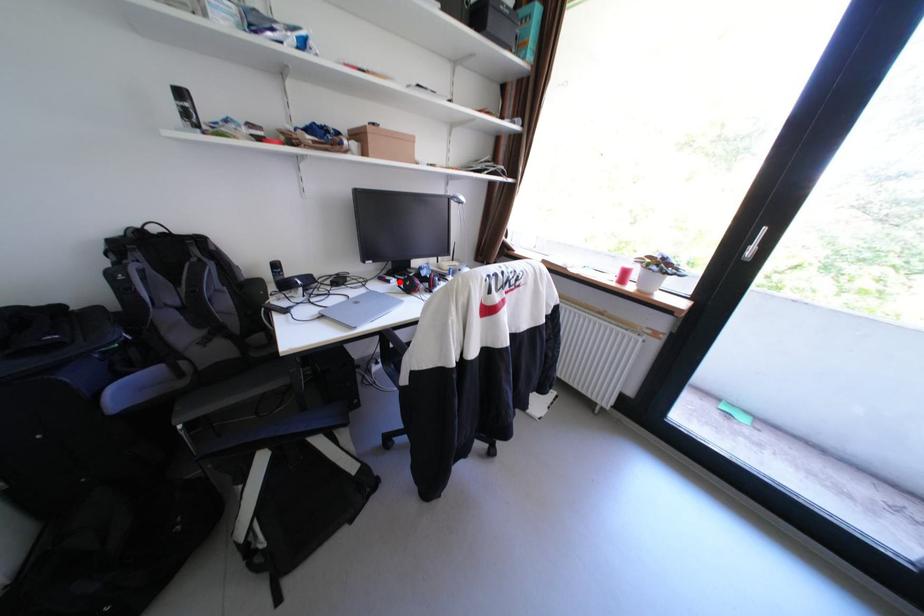
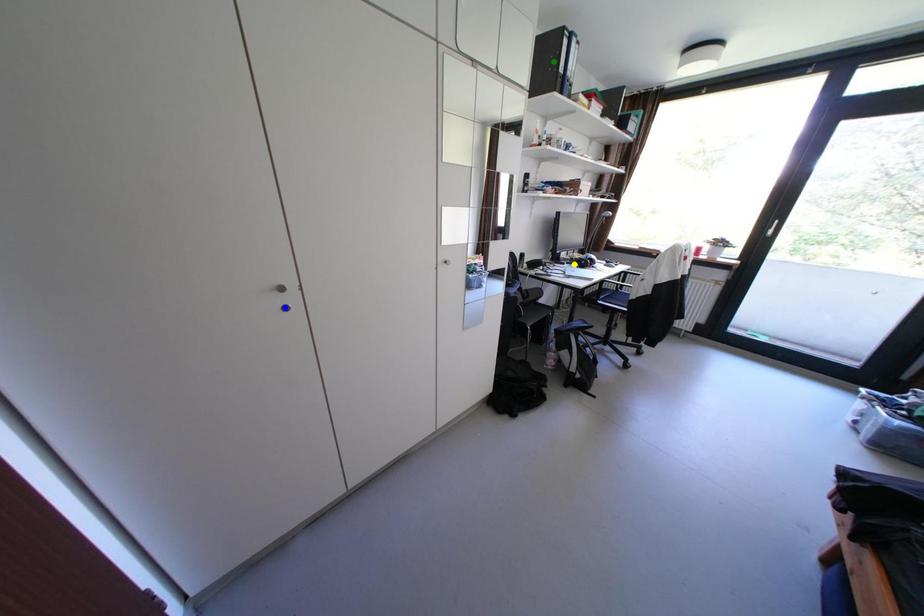
Question: I am providing you with two images of the same scene from different viewpoints. A red point is marked on the first image. You are given multiple points on the second image. Which mark in image 2 goes with the point in image 1?

Choices:
 (A) green point
 (B) blue point
 (C) yellow point

Answer: (C)